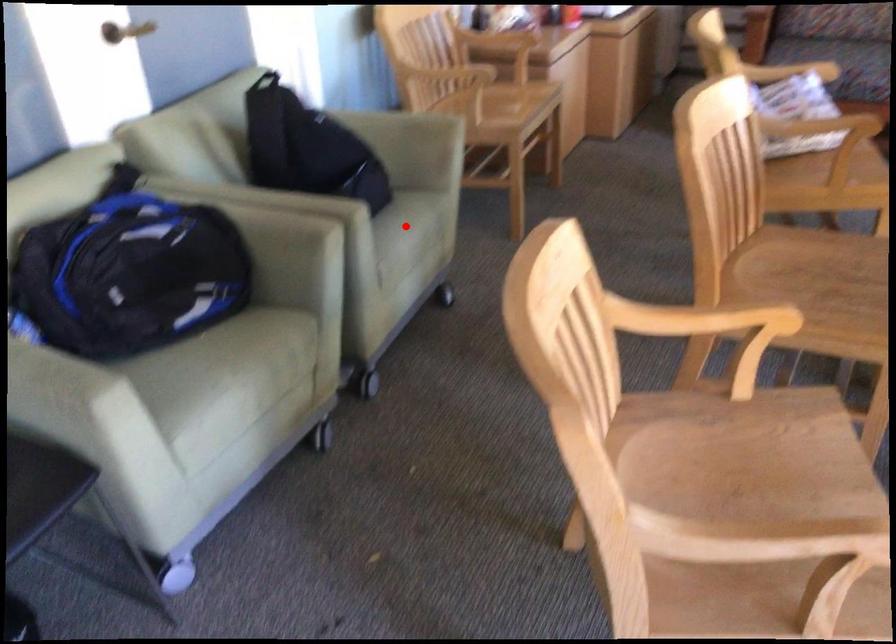
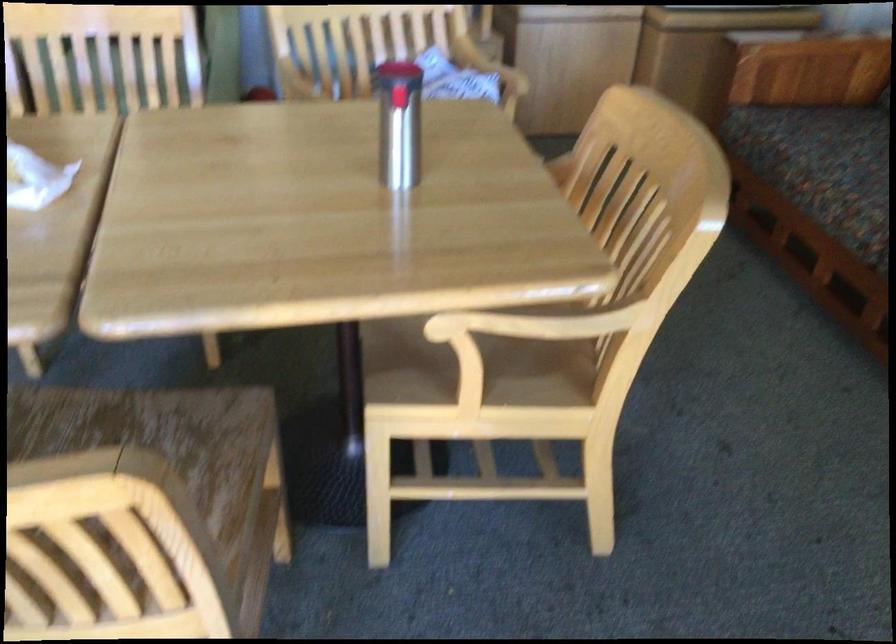
Question: I am providing you with two images of the same scene from different viewpoints. A red point is marked on the first image. At the location where the point appears in image 1, is it still visible in image 2?

Choices:
 (A) Yes
 (B) No

Answer: (B)